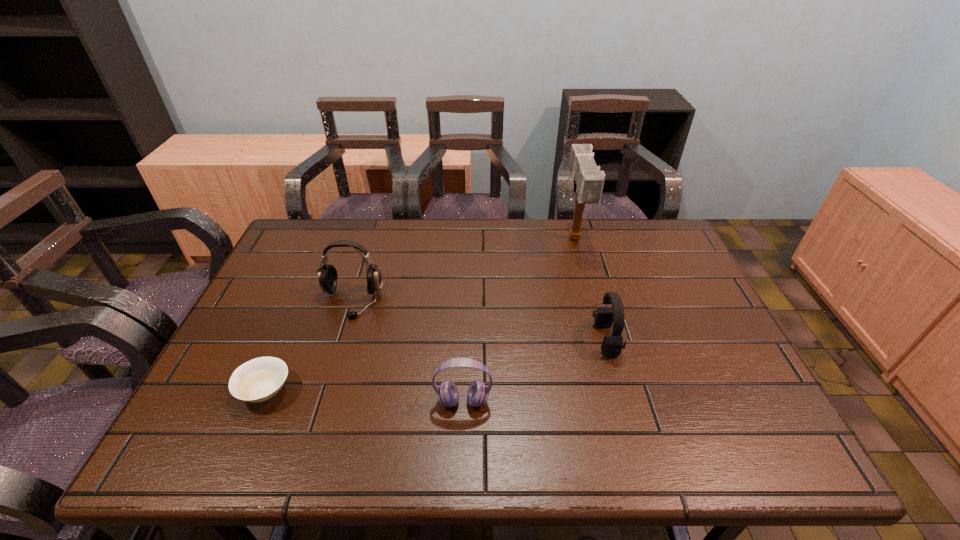
Image resolution: width=960 pixels, height=540 pixels. I want to click on free space located with the microphone on the side of the tallest headset, so click(339, 341).

The image size is (960, 540). In order to click on vacant space located 0.070m on the headband and ear cups of the third object from left to right in this screenshot , I will do pos(462,443).

At what (x,y) coordinates should I click in order to perform the action: click on vacant area situated 0.270m on the headband of the third nearest object. Please return your answer as a coordinate pair (x, y). This screenshot has width=960, height=540. Looking at the image, I should click on (489, 339).

At what (x,y) coordinates should I click in order to perform the action: click on vacant point located on the headband of the third nearest object. Please return your answer as a coordinate pair (x, y). Looking at the image, I should click on (497, 339).

The height and width of the screenshot is (540, 960). Find the location of `vacant area situated on the headband of the third nearest object`. vacant area situated on the headband of the third nearest object is located at coordinates [x=473, y=339].

This screenshot has height=540, width=960. Identify the location of free location located on the right of the bowl. (393, 390).

Where is `object present at the far edge`? The height and width of the screenshot is (540, 960). object present at the far edge is located at coordinates (589, 180).

Locate an element on the screen. The height and width of the screenshot is (540, 960). object at the left edge is located at coordinates (259, 379).

This screenshot has height=540, width=960. Find the location of `free space at the far edge of the desktop`. free space at the far edge of the desktop is located at coordinates (391, 235).

You are a GUI agent. You are given a task and a screenshot of the screen. Output one action in this format:
    pyautogui.click(x=<x>, y=<y>)
    Task: Click on the vacant space at the near edge
    Image resolution: width=960 pixels, height=540 pixels.
    Given the screenshot: What is the action you would take?
    pyautogui.click(x=376, y=456)